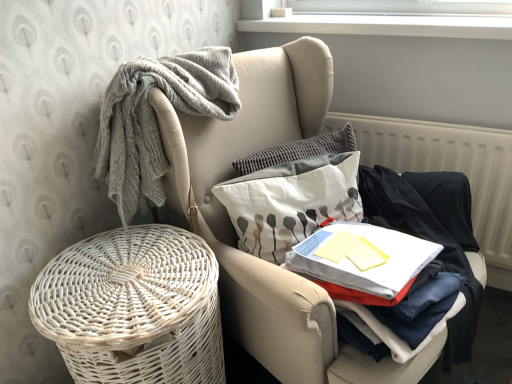
The height and width of the screenshot is (384, 512). What do you see at coordinates (426, 239) in the screenshot?
I see `dark blue cotton shirt at right` at bounding box center [426, 239].

Image resolution: width=512 pixels, height=384 pixels. Describe the element at coordinates (236, 234) in the screenshot. I see `white wicker basket at lower left` at that location.

The image size is (512, 384). I want to click on white fabric pillow with gray floral pattern at center, so click(x=291, y=202).

In order to face textured gray pillow at center, should I rotate leftwards or rightwards?

A 5.264 degree turn to the right will do.

Locate an element on the screen. dark blue cotton shirt at right is located at coordinates (426, 239).

Who is taller, textured gray pillow at center or white wicker basket at lower left?

With more height is white wicker basket at lower left.

Considering the relative positions of textured gray pillow at center and white wicker basket at lower left in the image provided, is textured gray pillow at center to the left or to the right of white wicker basket at lower left?

textured gray pillow at center is positioned on white wicker basket at lower left's right side.

Considering the positions of objects textured gray pillow at center and white wicker basket at lower left in the image provided, who is behind, textured gray pillow at center or white wicker basket at lower left?

Positioned behind is textured gray pillow at center.

Do you think textured gray pillow at center is within white wicker basket at lower left, or outside of it?

textured gray pillow at center is outside white wicker basket at lower left.

Considering the sizes of objects white textured radiator at right and white wicker basket at lower left in the image provided, who is bigger, white textured radiator at right or white wicker basket at lower left?

Bigger between the two is white wicker basket at lower left.

From the image's perspective, does white textured radiator at right appear lower than white wicker basket at lower left?

Incorrect, from the image's perspective, white textured radiator at right is higher than white wicker basket at lower left.

How much distance is there between white textured radiator at right and white wicker basket at lower left?

white textured radiator at right is 38.43 inches away from white wicker basket at lower left.

From a real-world perspective, between white textured radiator at right and white wicker basket at lower left, who is vertically lower?

white wicker basket at lower left is physically lower.

Is white textured radiator at right oriented away from white wicker basket at lower left?

No.

Between white textured radiator at right and white wicker basket at lower left, which one is positioned behind?

white textured radiator at right is further away from the camera.

Does white textured radiator at right have a larger size compared to white wicker basket at lower left?

No, white textured radiator at right is not bigger than white wicker basket at lower left.

What's the angular difference between white textured radiator at right and white wicker basket at lower left's facing directions?

The facing directions of white textured radiator at right and white wicker basket at lower left are 69.8 degrees apart.

From the image's perspective, between white wicker basket at lower left and textured gray pillow at center, which one is located above?

From the image's view, textured gray pillow at center is above.

Locate an element on the screen. Image resolution: width=512 pixels, height=384 pixels. pillow located behind the white wicker basket at lower left is located at coordinates (298, 151).

Which point is more distant from viewer, (212, 233) or (326, 151)?

Positioned behind is point (326, 151).

Is white wicker basket at lower left positioned beyond the bounds of textured gray pillow at center?

Yes.

From a real-world perspective, is transparent glass window at upper center positioned above or below white wicker basket at lower left?

transparent glass window at upper center is situated higher than white wicker basket at lower left in the real world.

From the image's perspective, is transparent glass window at upper center on top of white wicker basket at lower left?

Correct, transparent glass window at upper center appears higher than white wicker basket at lower left in the image.

Based on their sizes in the image, would you say transparent glass window at upper center is bigger or smaller than white wicker basket at lower left?

transparent glass window at upper center is smaller than white wicker basket at lower left.

Measure the distance between transparent glass window at upper center and white wicker basket at lower left.

transparent glass window at upper center and white wicker basket at lower left are 1.19 meters apart.

From a real-world perspective, is white wicker basket at lower left on transparent glass window at upper center?

No.

Can you see white wicker basket at lower left touching transparent glass window at upper center?

No, white wicker basket at lower left is not next to transparent glass window at upper center.

Considering the sizes of objects white wicker basket at lower left and transparent glass window at upper center in the image provided, who is smaller, white wicker basket at lower left or transparent glass window at upper center?

transparent glass window at upper center.

In the image, is transparent glass window at upper center on the left side or the right side of dark blue cotton shirt at right?

In the image, transparent glass window at upper center appears on the left side of dark blue cotton shirt at right.

Looking at this image, from a real-world perspective, does transparent glass window at upper center sit lower than dark blue cotton shirt at right?

Actually, transparent glass window at upper center is physically above dark blue cotton shirt at right in the real world.

Can you confirm if transparent glass window at upper center is wider than dark blue cotton shirt at right?

No.

Is transparent glass window at upper center outside of dark blue cotton shirt at right?

transparent glass window at upper center is positioned outside dark blue cotton shirt at right.

Locate an element on the screen. The image size is (512, 384). basket container below the textured gray pillow at center (from the image's perspective) is located at coordinates (134, 308).

The width and height of the screenshot is (512, 384). I want to click on radiator positioned vertically above the white wicker basket at lower left (from a real-world perspective), so click(447, 166).

When comparing their distances from dark blue cotton shirt at right, does transparent glass window at upper center or white fabric pillow with gray floral pattern at center seem further?

transparent glass window at upper center is further to dark blue cotton shirt at right.

Looking at this image, looking at the image, which one is located closer to dark blue cotton shirt at right, white fabric pillow with gray floral pattern at center or white textured radiator at right?

white fabric pillow with gray floral pattern at center is closer to dark blue cotton shirt at right.

Considering their positions, is white fabric pillow with gray floral pattern at center positioned closer to white wicker basket at lower left than white textured radiator at right?

Among the two, white fabric pillow with gray floral pattern at center is located nearer to white wicker basket at lower left.

Based on their spatial positions, is white wicker basket at lower left or white wicker basket at lower left closer to white textured radiator at right?

The object closer to white textured radiator at right is white wicker basket at lower left.

Estimate the real-world distances between objects in this image. Which object is further from white textured radiator at right, white wicker basket at lower left or white fabric pillow with gray floral pattern at center?

white wicker basket at lower left is further to white textured radiator at right.

From the image, which object appears to be farther from transparent glass window at upper center, white fabric pillow with gray floral pattern at center or textured gray pillow at center?

white fabric pillow with gray floral pattern at center.

Considering their positions, is textured gray pillow at center positioned closer to white wicker basket at lower left than white fabric pillow with gray floral pattern at center?

white fabric pillow with gray floral pattern at center.

In the scene shown: Which object lies nearer to the anchor point transparent glass window at upper center, white wicker basket at lower left or white fabric pillow with gray floral pattern at center?

Based on the image, white wicker basket at lower left appears to be nearer to transparent glass window at upper center.

This screenshot has height=384, width=512. I want to click on clothing located between textured gray pillow at center and white textured radiator at right in the left-right direction, so click(426, 239).

Where is `throw pillow between transparent glass window at upper center and dark blue cotton shirt at right from top to bottom`? throw pillow between transparent glass window at upper center and dark blue cotton shirt at right from top to bottom is located at coordinates (291, 202).

I want to click on clothing between white wicker basket at lower left and white textured radiator at right from front to back, so click(x=426, y=239).

Where is `pillow between white wicker basket at lower left and white textured radiator at right in the front-back direction`? pillow between white wicker basket at lower left and white textured radiator at right in the front-back direction is located at coordinates (298, 151).